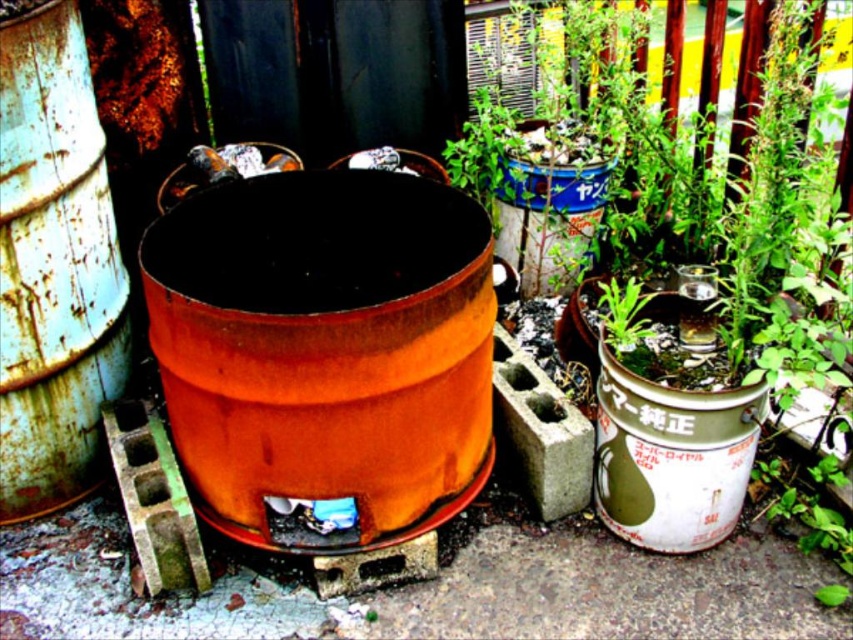
Question: Is rusty metal barrel at center to the left of rusty metal barrel at center-left from the viewer's perspective?

Choices:
 (A) yes
 (B) no

Answer: (B)

Question: Which point is closer to the camera taking this photo?

Choices:
 (A) (1, 356)
 (B) (399, 432)

Answer: (B)

Question: Is green matte plant at center to the right of rusty metal barrel at center-left from the viewer's perspective?

Choices:
 (A) yes
 (B) no

Answer: (A)

Question: Estimate the real-world distances between objects in this image. Which object is closer to the rusty metal barrel at center?

Choices:
 (A) rusty metal barrel at center-left
 (B) green matte plant at center

Answer: (A)

Question: Estimate the real-world distances between objects in this image. Which object is closer to the green matte plant at center?

Choices:
 (A) rusty metal barrel at center-left
 (B) rusty metal barrel at center

Answer: (B)

Question: Is rusty metal barrel at center closer to the viewer compared to rusty metal barrel at center-left?

Choices:
 (A) yes
 (B) no

Answer: (A)